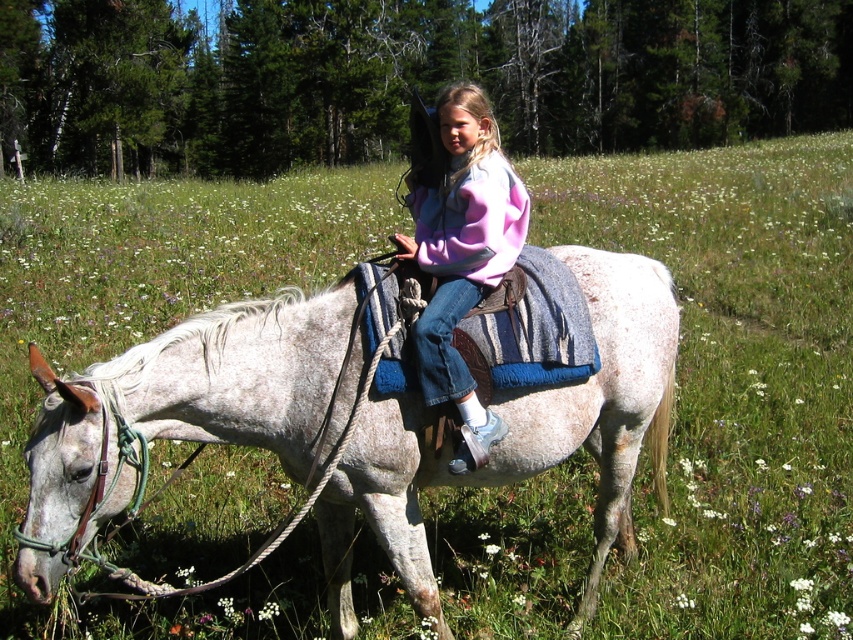
You are standing at the origin point of the coordinate system in this image. The speckled white horse at center is located at point (519, 440). If you want to approach the horse, which direction should you move in terms of the coordinate system?

To approach the speckled white horse at center located at point (519, 440) from the origin, you should move towards the positive x and y directions since the coordinates are both greater than zero.

You are a photographer trying to capture a clear photo of the speckled white horse at center and the pastel fleece sweater at center. Which object is shorter?

The speckled white horse at center is shorter than the pastel fleece sweater at center.

You are a photographer standing in the field. You want to take a photo of the speckled white horse at center and the pastel fleece sweater at center. Based on their positions, which object should you adjust your camera to focus on first if you want to capture both in the frame?

The speckled white horse at center is to the right of the pastel fleece sweater at center, so you should focus on the pastel fleece sweater at center first to ensure both are in the frame.